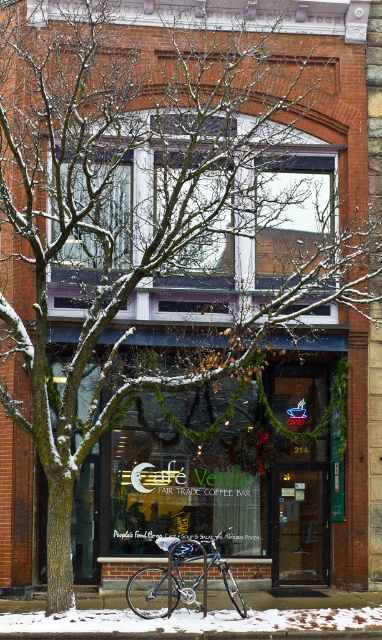
You are a customer arriving at the entrance of the cafe and notice the white powdery snow at lower center and the shiny blue bicycle at center. Where would you find the white powdery snow in relation to the shiny blue bicycle?

The white powdery snow at lower center is positioned under the shiny blue bicycle at center.

You are a delivery person who needs to park your shiny blue bicycle at center near the white powdery snow at lower center. Given that the snow is bigger than the bicycle, will there be enough space to park the bicycle on the snow?

The white powdery snow at lower center is bigger than the shiny blue bicycle at center, so there should be enough space to park the bicycle on the snow.